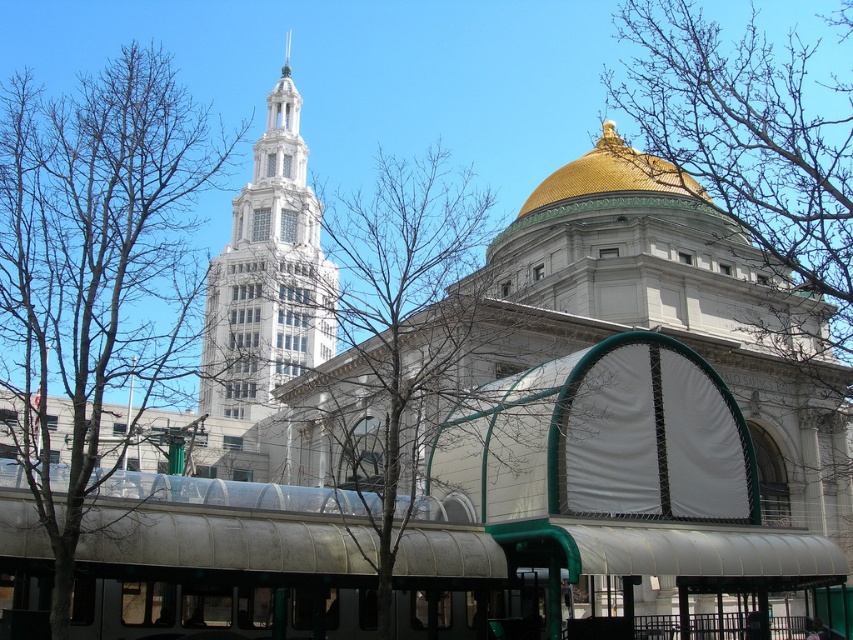
Question: Does white fabric awning at center have a greater width compared to bare branches at center?

Choices:
 (A) yes
 (B) no

Answer: (B)

Question: Which point is closer to the camera?

Choices:
 (A) white stone tower at upper left
 (B) white fabric awning at center
 (C) gold metallic dome at upper center

Answer: (B)

Question: Is white fabric awning at center to the left of bare branches at center from the viewer's perspective?

Choices:
 (A) yes
 (B) no

Answer: (B)

Question: Which of the following is the closest to the observer?

Choices:
 (A) (653, 161)
 (B) (426, 369)
 (C) (808, 282)
 (D) (286, 124)

Answer: (B)

Question: Which of the following is the closest to the observer?

Choices:
 (A) (653, 342)
 (B) (126, 252)

Answer: (B)

Question: Can you confirm if bare branches at upper right is positioned to the left of gold metallic dome at upper center?

Choices:
 (A) no
 (B) yes

Answer: (A)